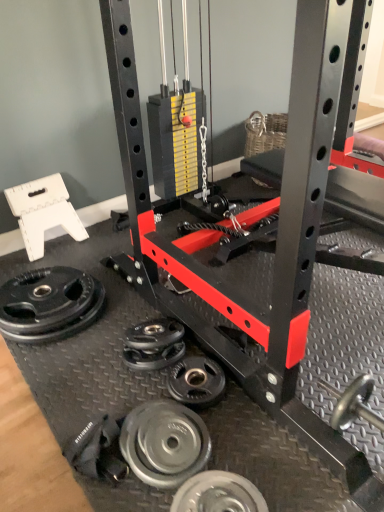
Where is `free space to the left of silver metallic weight plate at lower center, marked as the third wheel in a bottom-to-top arrangement`? This screenshot has width=384, height=512. free space to the left of silver metallic weight plate at lower center, marked as the third wheel in a bottom-to-top arrangement is located at coordinates (124, 387).